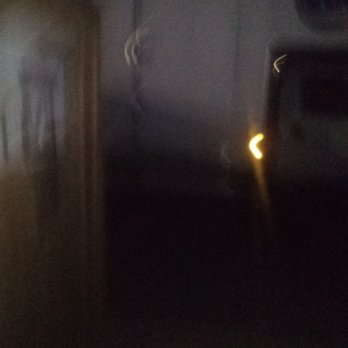
Locate an element on the screen. The image size is (348, 348). light is located at coordinates click(257, 145).